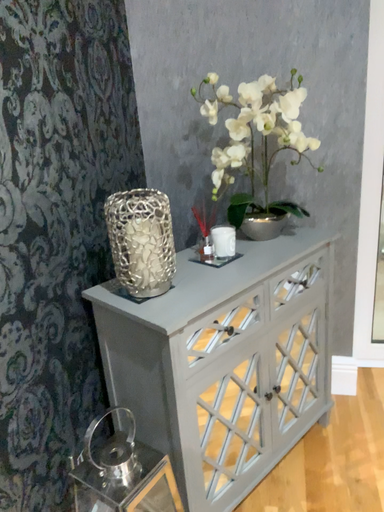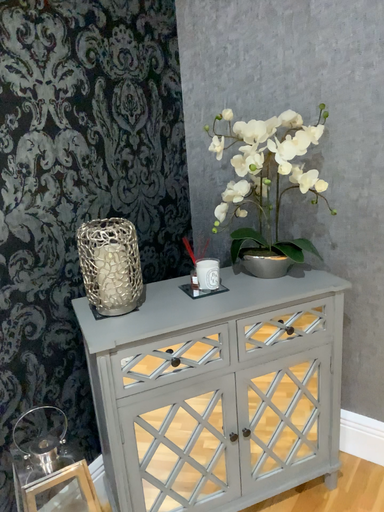
Question: How did the camera likely rotate when shooting the video?

Choices:
 (A) rotated left
 (B) rotated right

Answer: (A)